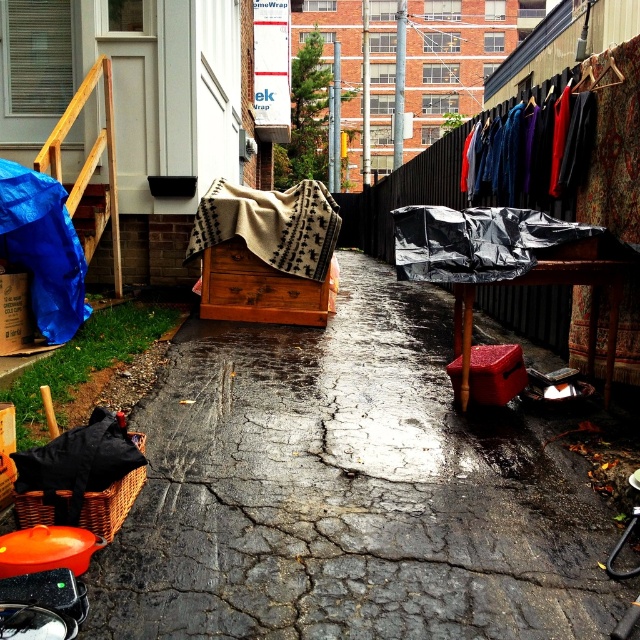
Question: Does beige textured blanket at center have a larger size compared to black woven basket at lower left?

Choices:
 (A) no
 (B) yes

Answer: (B)

Question: Which of the following is the closest to the observer?

Choices:
 (A) (260, 305)
 (B) (392, 515)
 (C) (464, 355)
 (D) (198, 250)

Answer: (B)

Question: Which of the following is the closest to the observer?

Choices:
 (A) wooden staircase at left
 (B) red plastic stool at center
 (C) dark gray asphalt at center
 (D) beige textured blanket at center

Answer: (C)

Question: Among these objects, which one is nearest to the camera?

Choices:
 (A) beige textured blanket at center
 (B) wooden staircase at left

Answer: (B)

Question: Can you confirm if beige textured blanket at center is positioned to the left of red plastic stool at center?

Choices:
 (A) yes
 (B) no

Answer: (A)

Question: Can you confirm if beige textured blanket at center is positioned to the left of wooden chest at center?

Choices:
 (A) yes
 (B) no

Answer: (A)